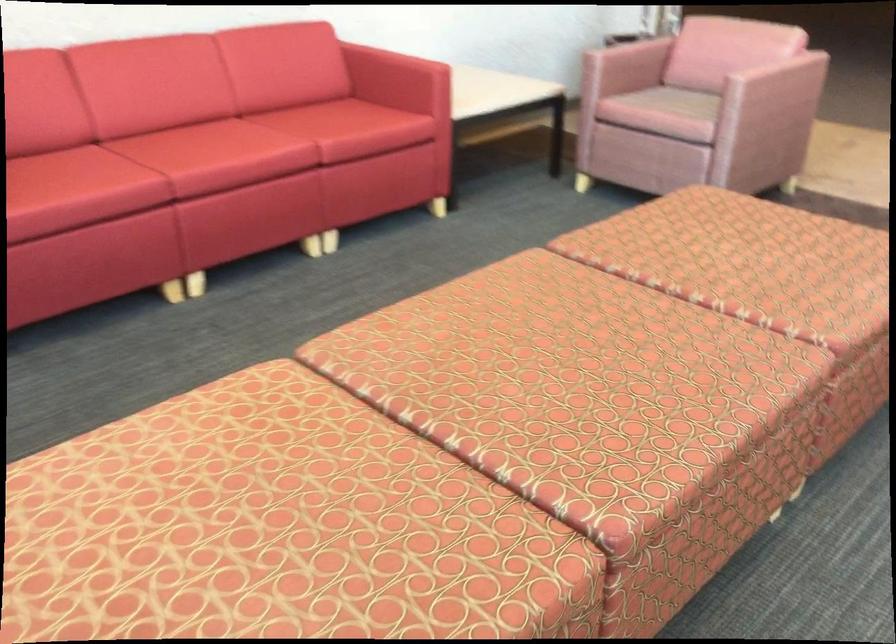
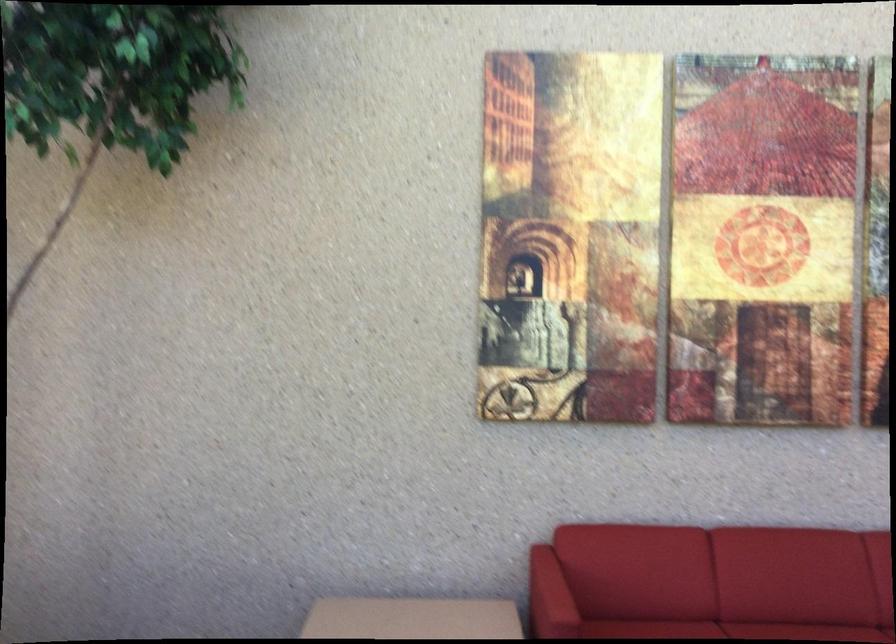
Locate, in the second image, the point that corresponds to pixel 112 149 in the first image.

(727, 630)